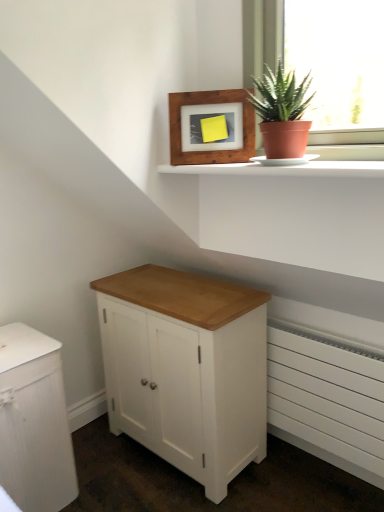
At what (x,y) coordinates should I click in order to perform the action: click on vacant space situated above white wood cabinet at center, acting as the first chest of drawers starting from the right (from a real-world perspective). Please return your answer as a coordinate pair (x, y). Image resolution: width=384 pixels, height=512 pixels. Looking at the image, I should click on (188, 295).